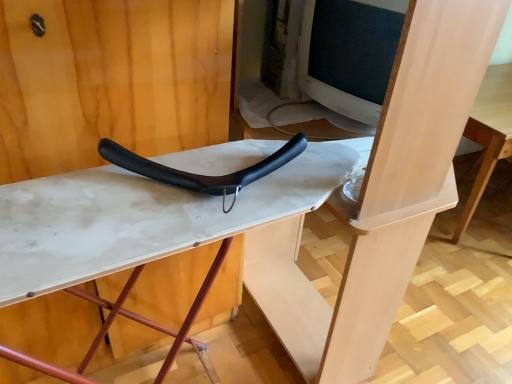
Question: Relative to white matte ironing board at center, is black matte handle at center in front or behind?

Choices:
 (A) front
 (B) behind

Answer: (B)

Question: Considering the positions of black matte handle at center and white matte ironing board at center in the image, is black matte handle at center wider or thinner than white matte ironing board at center?

Choices:
 (A) wide
 (B) thin

Answer: (B)

Question: In terms of height, does black matte handle at center look taller or shorter compared to white matte ironing board at center?

Choices:
 (A) tall
 (B) short

Answer: (B)

Question: Considering the positions of white matte ironing board at center and black matte handle at center in the image, is white matte ironing board at center bigger or smaller than black matte handle at center?

Choices:
 (A) big
 (B) small

Answer: (A)

Question: Looking at their shapes, would you say white matte ironing board at center is wider or thinner than black matte handle at center?

Choices:
 (A) wide
 (B) thin

Answer: (A)

Question: Is white matte ironing board at center situated inside black matte handle at center or outside?

Choices:
 (A) inside
 (B) outside

Answer: (B)

Question: From the image's perspective, is white matte ironing board at center located above or below black matte handle at center?

Choices:
 (A) above
 (B) below

Answer: (B)